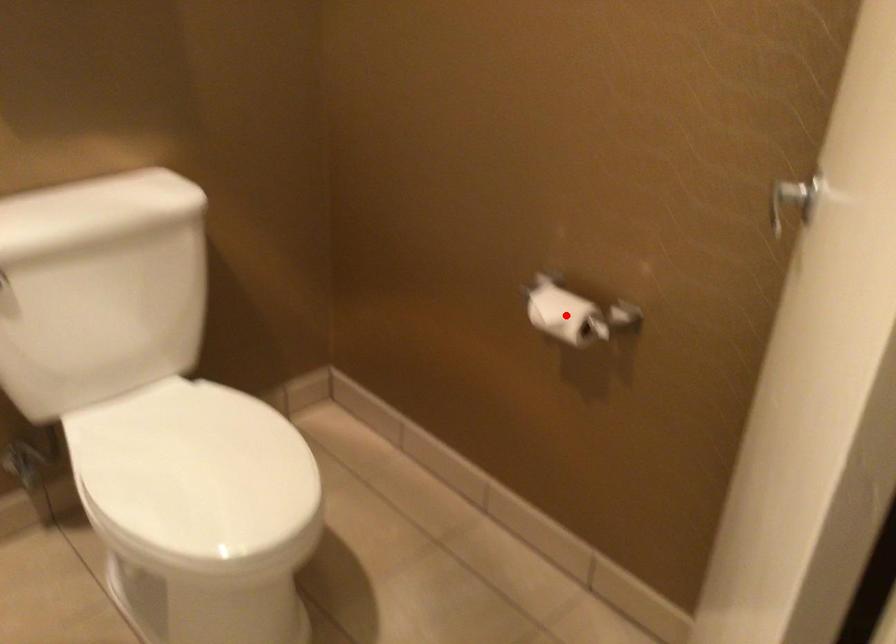
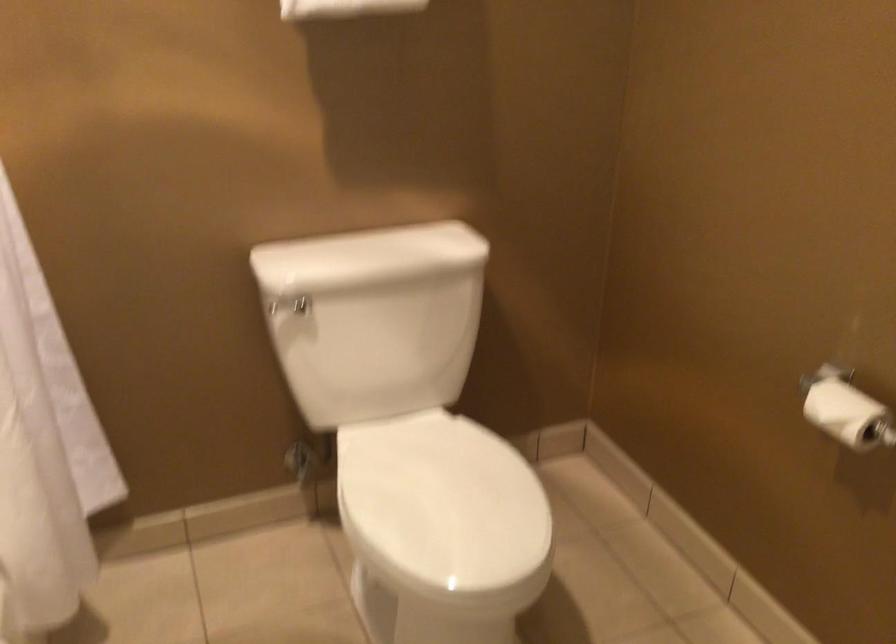
Locate, in the second image, the point that corresponds to the highlighted location in the first image.

(847, 413)